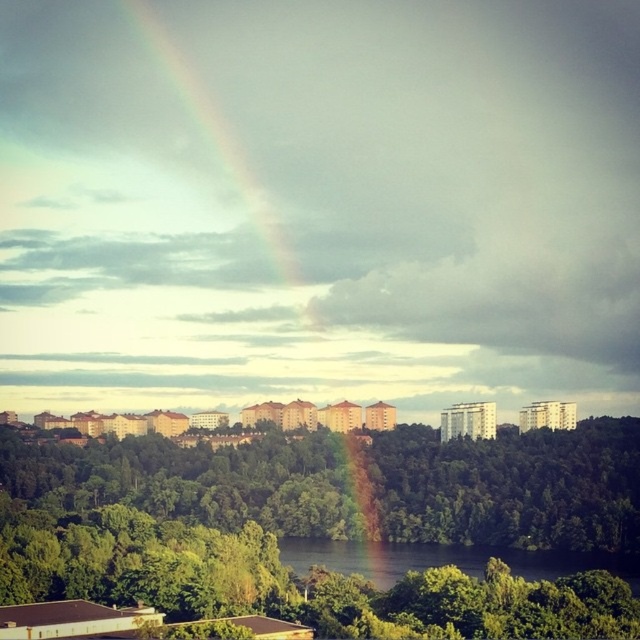
Question: Which point is farther from the camera taking this photo?

Choices:
 (A) (272, 237)
 (B) (349, 500)

Answer: (A)

Question: Is green leafy tree at center smaller than rainbow at upper center?

Choices:
 (A) no
 (B) yes

Answer: (B)

Question: Does green leafy tree at center have a smaller size compared to rainbow at upper center?

Choices:
 (A) no
 (B) yes

Answer: (B)

Question: Can you confirm if green leafy tree at center is positioned above rainbow at upper center?

Choices:
 (A) yes
 (B) no

Answer: (B)

Question: Which of the following is the closest to the observer?

Choices:
 (A) (394, 616)
 (B) (204, 97)

Answer: (A)